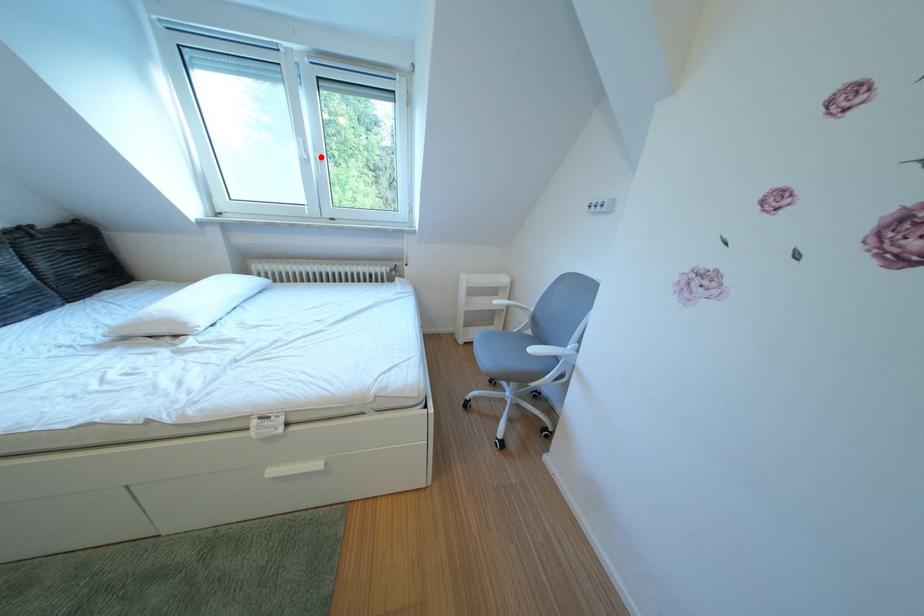
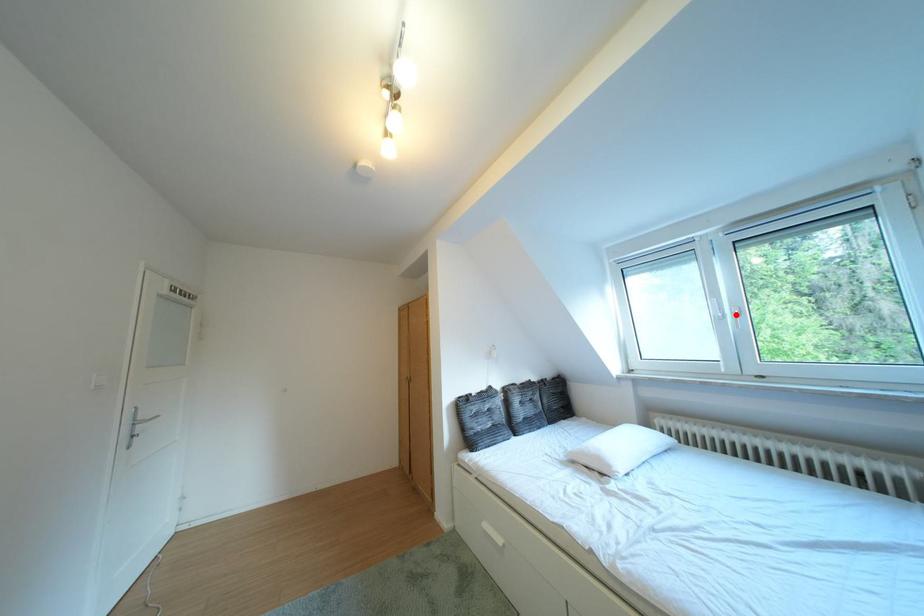
I am providing you with two images of the same scene from different viewpoints. A red point is marked on the first image and another point is marked on the second image. Does the point marked in image1 correspond to the same location as the one in image2?

Yes